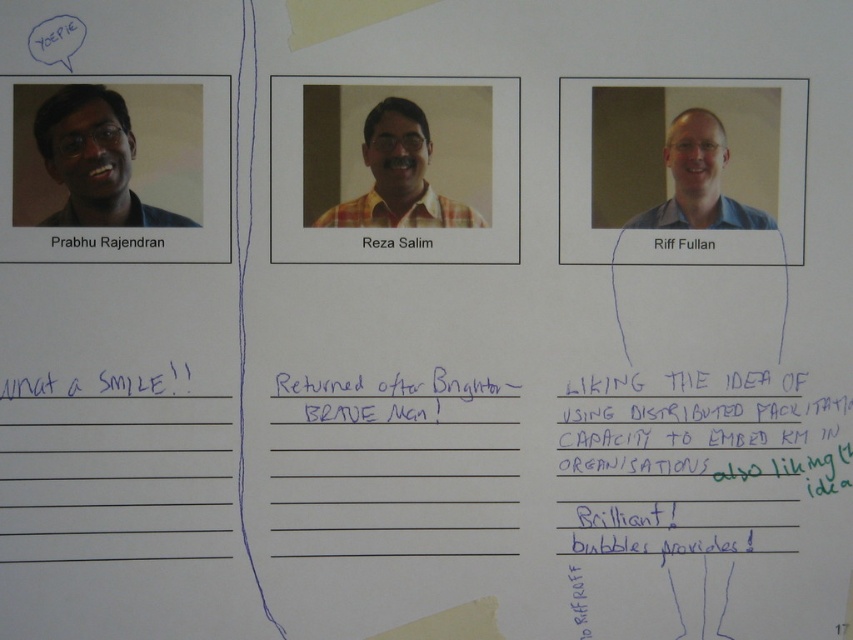
Looking at the whiteboard, which object is bigger between the yellow plaid shirt at center and the black ink writing at center?

The yellow plaid shirt at center is larger in size than the black ink writing at center.

You are an assistant organizing a presentation about the whiteboard. You need to mention all three people and their sections. Where is the black ink writing at center in relation to Reza Salim?

The black ink writing at center is located at point (387, 397) relative to Reza Salim.

From the picture: You are a teacher looking at the whiteboard and want to write a note about the blue shirt at center. Where should you place your new note in relation to the black ink writing at center?

The black ink writing at center is shorter than blue shirt at center, so you should place your new note below the black ink writing at center to avoid overlapping with the blue shirt at center.